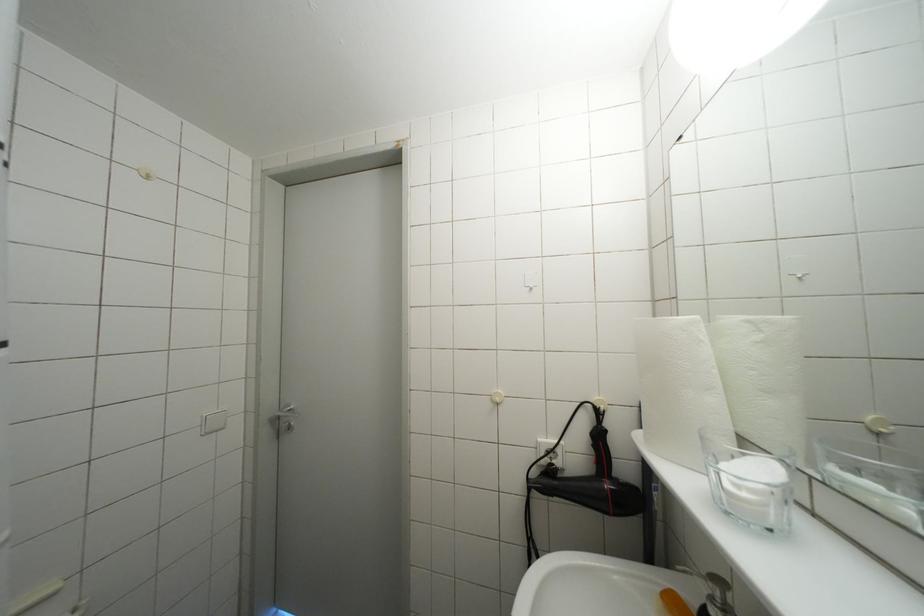
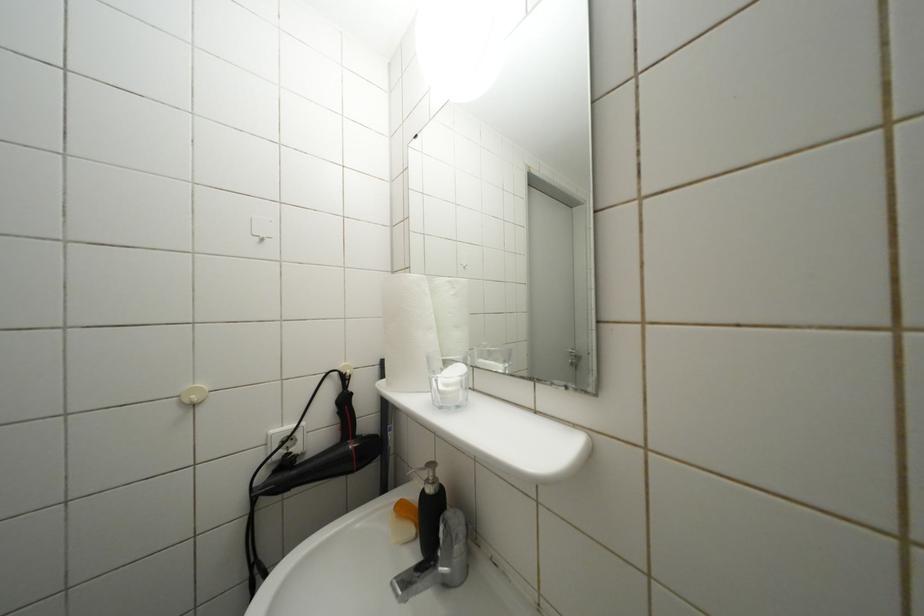
Question: The camera is either moving clockwise (left) or counter-clockwise (right) around the object. The first image is from the beginning of the video and the second image is from the end. Is the camera moving left or right when shooting the video?

Choices:
 (A) Left
 (B) Right

Answer: (A)